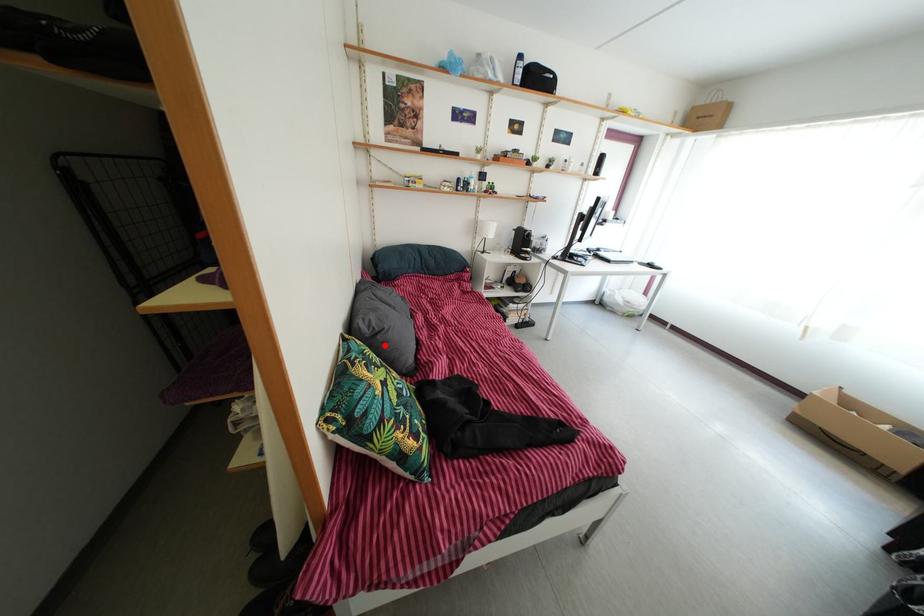
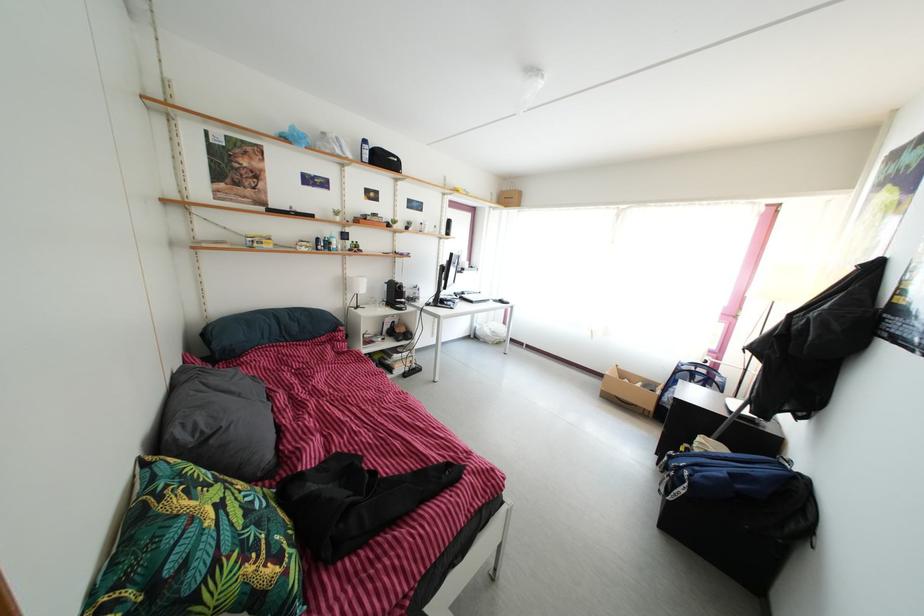
Locate, in the second image, the point that corresponds to the highlighted location in the first image.

(217, 450)